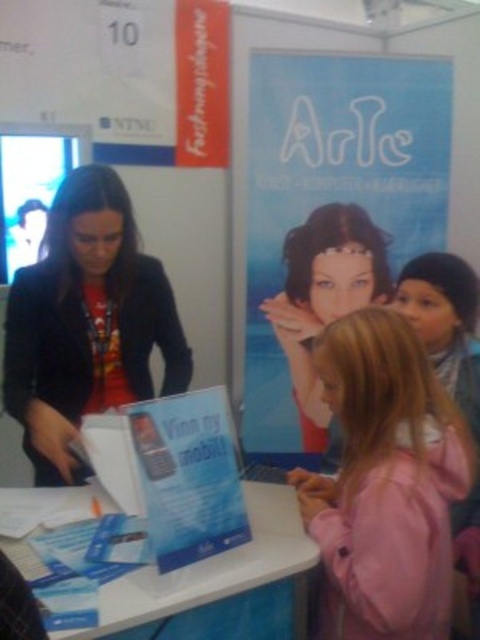
Does blue paper poster at center have a greater height compared to matte black jacket at left?

Yes, blue paper poster at center is taller than matte black jacket at left.

This screenshot has width=480, height=640. What are the coordinates of `blue paper poster at center` in the screenshot? It's located at (332, 212).

Image resolution: width=480 pixels, height=640 pixels. Describe the element at coordinates (385, 483) in the screenshot. I see `pink fabric jacket at lower right` at that location.

Is point (388, 605) positioned behind point (312, 436)?

No.

Which is behind, point (336, 522) or point (282, 304)?

Positioned behind is point (282, 304).

Locate an element on the screen. The image size is (480, 640). pink fabric jacket at lower right is located at coordinates (385, 483).

Is matte black jacket at left in front of white plastic table at lower center?

No, matte black jacket at left is behind white plastic table at lower center.

Does matte black jacket at left have a larger size compared to white plastic table at lower center?

Correct, matte black jacket at left is larger in size than white plastic table at lower center.

Who is more distant from viewer, (84, 209) or (230, 573)?

The point (84, 209) is behind.

Image resolution: width=480 pixels, height=640 pixels. What are the coordinates of `matte black jacket at left` in the screenshot? It's located at (86, 323).